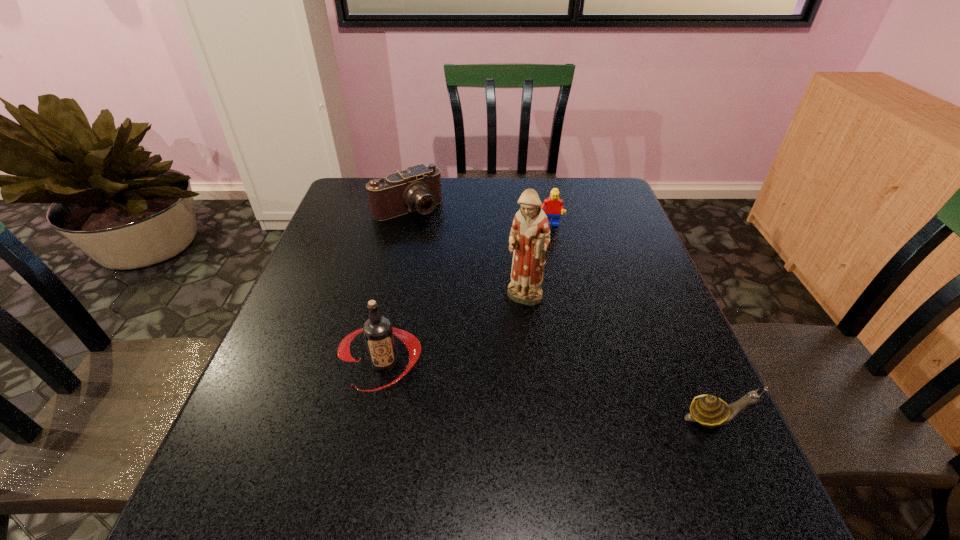
This screenshot has width=960, height=540. Identify the location of vacant space on the desktop that is between the second tallest object and the nearest object and is positioned on the front-facing side of the camera. [566, 393].

Find the location of a particular element. The height and width of the screenshot is (540, 960). vacant space on the desktop that is between the second nearest object and the rightmost object and is positioned on the front-facing side of the second object from right to left is located at coordinates (568, 394).

The height and width of the screenshot is (540, 960). I want to click on vacant space on the desktop that is between the second nearest object and the nearest object and is positioned on the front-facing side of the third nearest object, so click(x=505, y=383).